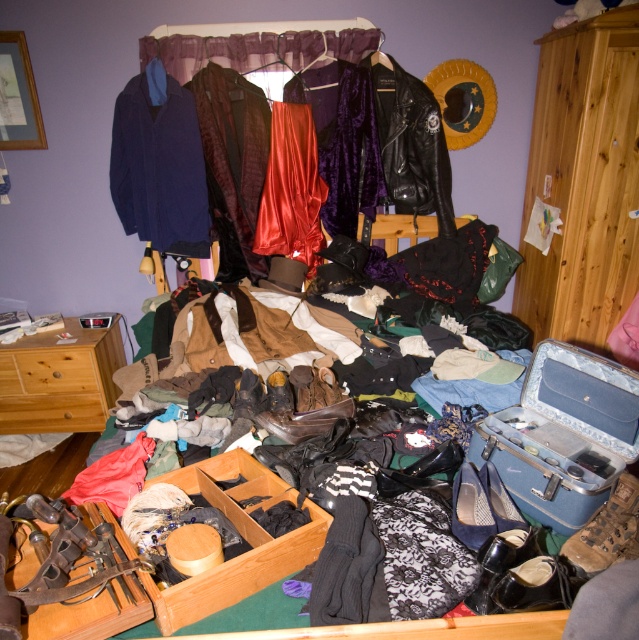
You are organizing the clothes on the bed and need to place a velvet jacket at center and a leather boot at center in a specific arrangement. According to the image, which item is positioned to the left of the other?

The velvet jacket at center is to the left of the leather boot at center.

You are organizing the clutter in the bedroom and need to place the black leather jacket at center into the wooden drawer at lower left. Can you directly put the jacket into the drawer without moving any other items?

The black leather jacket at center is already positioned over the wooden drawer at lower left, so you can directly put the jacket into the drawer without moving any other items.